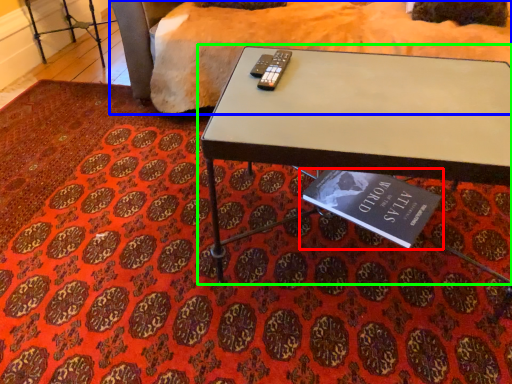
Question: Considering the real-world distances, which object is closest to book (highlighted by a red box)? bedding (highlighted by a blue box) or table (highlighted by a green box).

Choices:
 (A) bedding
 (B) table

Answer: (B)